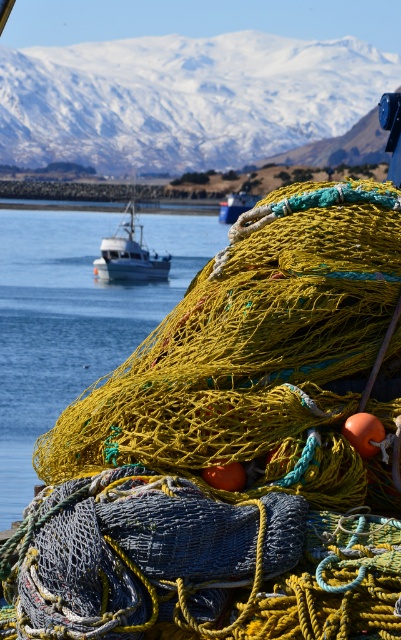
Question: Which object is positioned farthest from the white matte boat at center?

Choices:
 (A) transparent blue water at center
 (B) white plastic boat at center

Answer: (B)

Question: Is snowy white mountain at upper center positioned in front of white matte boat at center?

Choices:
 (A) no
 (B) yes

Answer: (A)

Question: Which of the following is the closest to the observer?

Choices:
 (A) [x=2, y=429]
 (B) [x=319, y=548]
 (C) [x=245, y=209]
 (D) [x=119, y=262]

Answer: (B)

Question: Which of these objects is positioned closest to the transparent blue water at center?

Choices:
 (A) white plastic boat at center
 (B) white matte boat at center

Answer: (B)

Question: Does transparent blue water at center have a greater width compared to white matte boat at center?

Choices:
 (A) yes
 (B) no

Answer: (A)

Question: In this image, where is blue textured net at center located relative to snowy white mountain at upper center?

Choices:
 (A) above
 (B) below

Answer: (B)